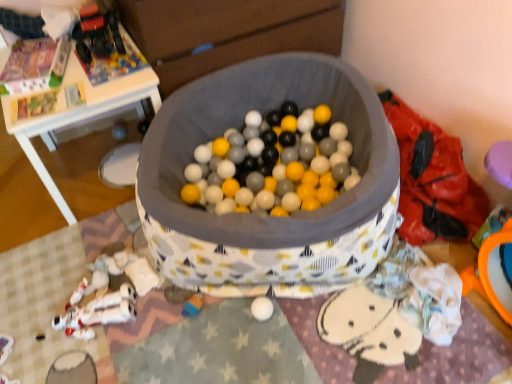
Where is `free space to the left of white plastic toy at lower left, the 2th toy ordered from the bottom`? free space to the left of white plastic toy at lower left, the 2th toy ordered from the bottom is located at coordinates (33, 316).